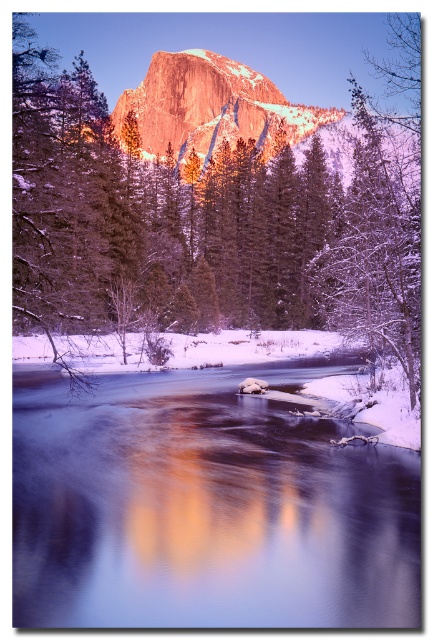
Question: Which object is the closest to the smooth ice stream at lower center?

Choices:
 (A) shiny granite mountain at center
 (B) snow-covered tree at right
 (C) snowy evergreen tree at center

Answer: (B)

Question: Is snow-covered tree at right wider than shiny granite mountain at center?

Choices:
 (A) no
 (B) yes

Answer: (B)

Question: Which point is farther from the camera taking this photo?

Choices:
 (A) (374, 278)
 (B) (97, 163)
 (C) (323, 124)

Answer: (C)

Question: Among these points, which one is nearest to the camera?

Choices:
 (A) (301, 113)
 (B) (71, 257)

Answer: (B)

Question: Can you confirm if snowy evergreen tree at center is positioned above smooth ice stream at lower center?

Choices:
 (A) no
 (B) yes

Answer: (B)

Question: Can you confirm if smooth ice stream at lower center is positioned to the right of shiny granite mountain at center?

Choices:
 (A) no
 (B) yes

Answer: (B)